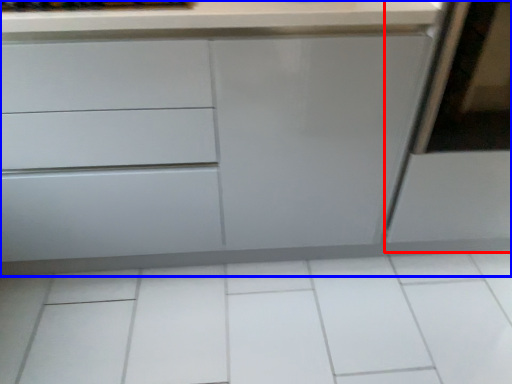
Question: Which point is further to the camera, screen door (highlighted by a red box) or chest of drawers (highlighted by a blue box)?

Choices:
 (A) screen door
 (B) chest of drawers

Answer: (A)